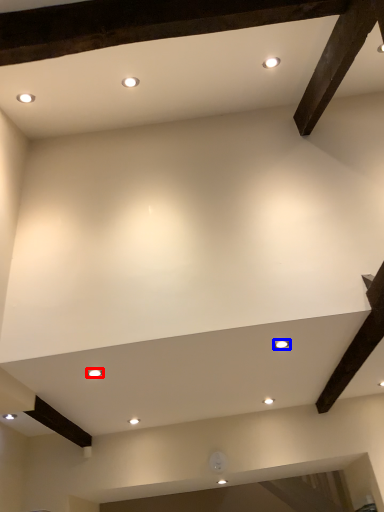
Question: Which of the following is the closest to the observer, lighting (highlighted by a red box) or lighting (highlighted by a blue box)?

Choices:
 (A) lighting
 (B) lighting

Answer: (B)